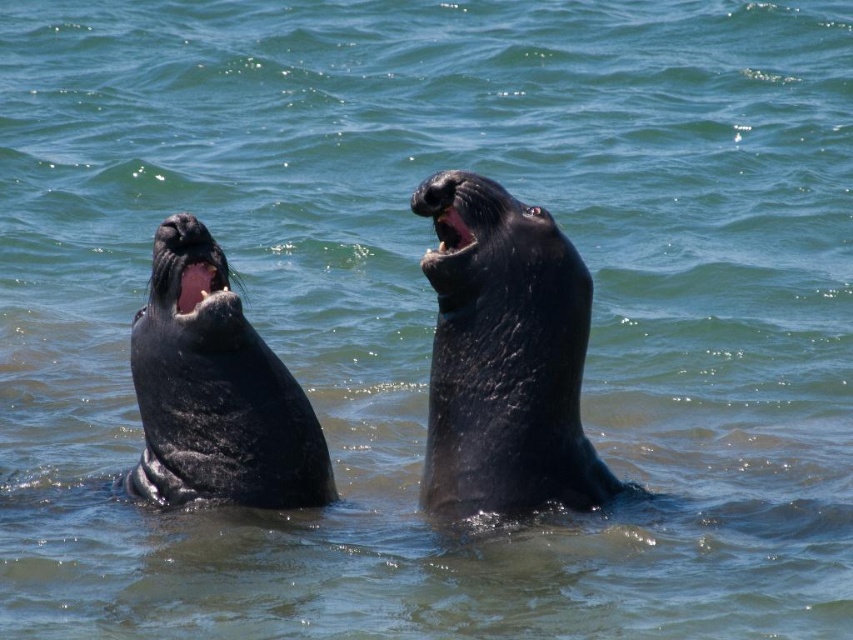
Question: Among these points, which one is nearest to the camera?

Choices:
 (A) (454, 224)
 (B) (440, 253)
 (C) (195, 435)

Answer: (B)

Question: Which object is positioned farthest from the shiny black seal at left?

Choices:
 (A) shiny black seal at center
 (B) black matte seal mouth at upper center

Answer: (B)

Question: Can you confirm if shiny black seal at center is wider than black matte seal mouth at upper center?

Choices:
 (A) no
 (B) yes

Answer: (B)

Question: Is shiny black seal at center closer to the viewer compared to shiny black seal at left?

Choices:
 (A) yes
 (B) no

Answer: (A)

Question: Can you confirm if shiny black seal at center is smaller than shiny black seal at left?

Choices:
 (A) yes
 (B) no

Answer: (A)

Question: Which of the following is the closest to the observer?

Choices:
 (A) (450, 224)
 (B) (543, 484)

Answer: (A)